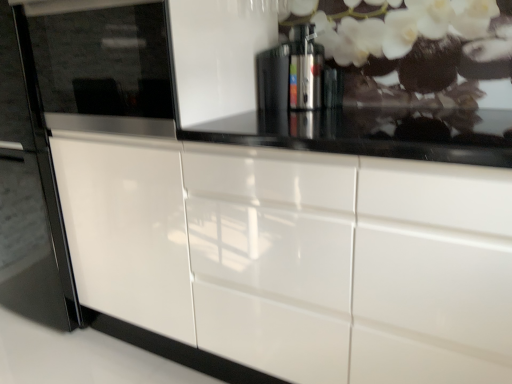
Question: From a real-world perspective, is satin silver coffee machine at center physically located above or below glossy white cabinet at center?

Choices:
 (A) below
 (B) above

Answer: (B)

Question: Would you say satin silver coffee machine at center is inside or outside glossy white cabinet at center?

Choices:
 (A) inside
 (B) outside

Answer: (B)

Question: Which object is positioned closest to the satin silver coffee machine at center?

Choices:
 (A) glossy white fridge at left
 (B) glossy black microwave at left
 (C) glossy white cabinet at center

Answer: (B)

Question: Based on their relative distances, which object is nearer to the satin silver coffee machine at center?

Choices:
 (A) glossy white fridge at left
 (B) glossy white cabinet at center
 (C) glossy black microwave at left

Answer: (C)